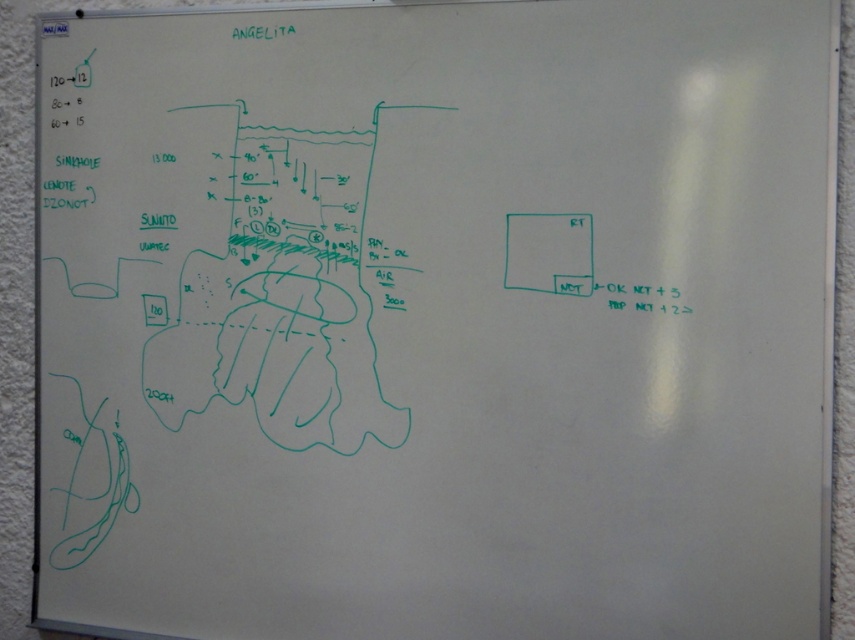
You are a student who needs to attach a label to the right side of the whiteboard. You have two options available, the white paper at right and the black ink at right. Which one has a smaller width to ensure it doesn

The white paper at right has a width that is less than the black ink at right, so the white paper at right is the smaller one and would be better for attaching if you need something narrower.

You are a presenter standing at the front of the room and need to reference both the white paper at right and the black ink at right on the whiteboard. How far apart are these two items on the whiteboard?

The white paper at right is 3.17 inches from the black ink at right, so they are approximately 3.17 inches apart on the whiteboard.

You are a student who needs to present a project on Angelita. You see the white paper at right and the black ink at right on the whiteboard. Which one can you use to write additional notes for your presentation?

The white paper at right has a larger size compared to the black ink at right, so you can use the white paper at right to write additional notes since it provides more space.